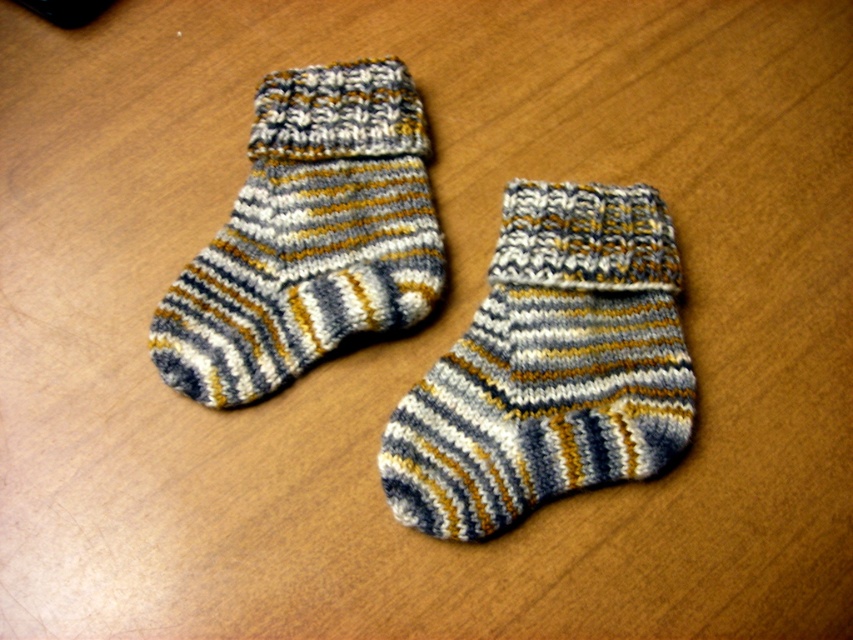
Who is lower down, striped woolen sock at center or striped woolen sock at upper left?

striped woolen sock at center

The width and height of the screenshot is (853, 640). I want to click on striped woolen sock at center, so click(549, 365).

Locate an element on the screen. striped woolen sock at center is located at coordinates (549, 365).